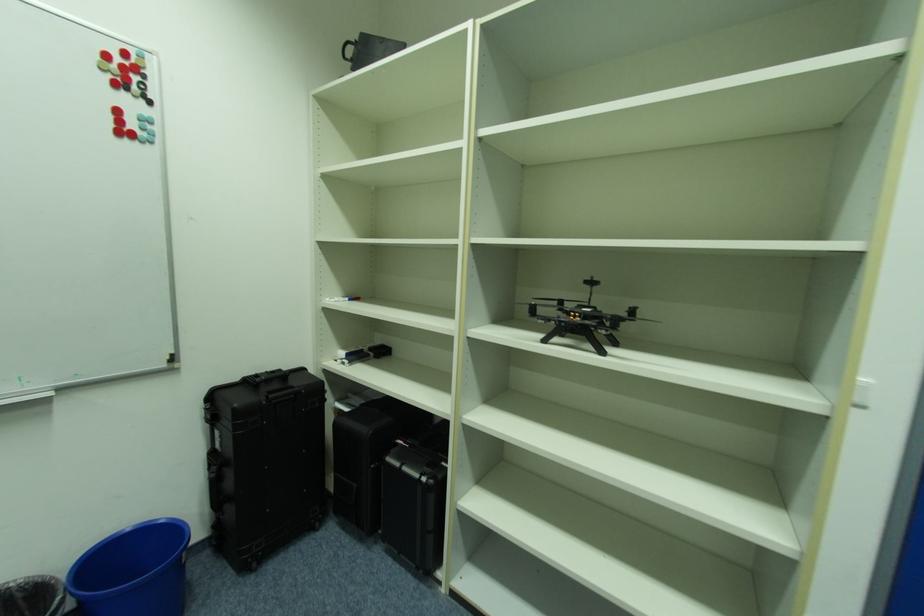
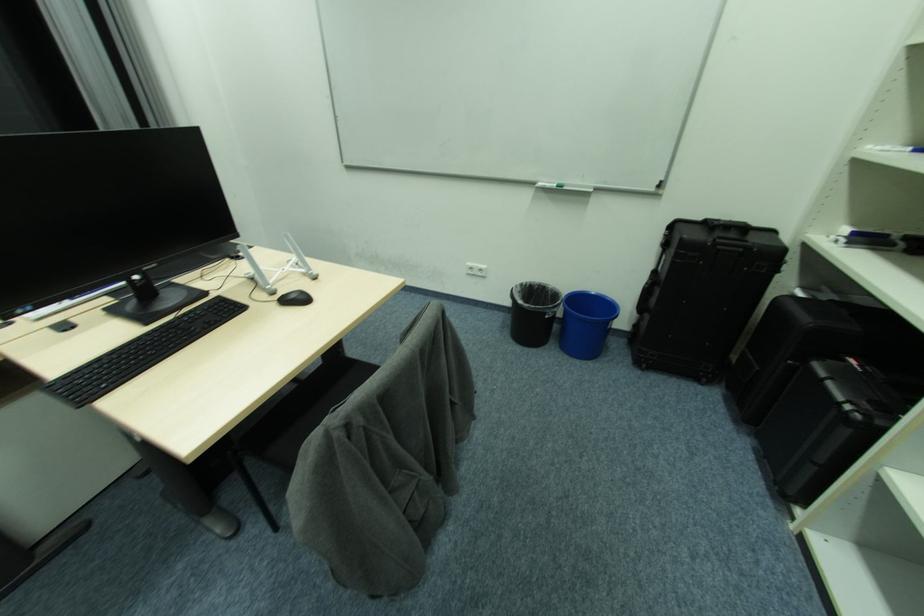
How did the camera likely rotate?

The camera rotated toward left-down.